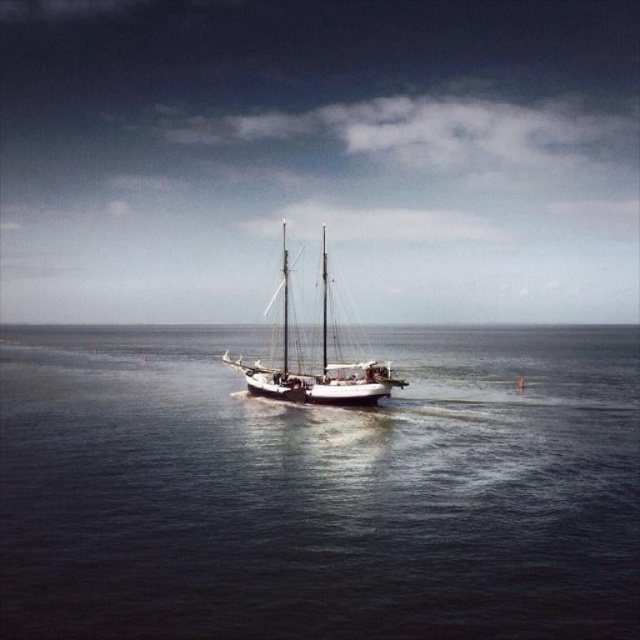
Question: Is the position of dark blue water at center less distant than that of white wooden sailboat at center?

Choices:
 (A) no
 (B) yes

Answer: (B)

Question: Which of the following is the closest to the observer?

Choices:
 (A) white wooden sailboat at center
 (B) dark blue water at center

Answer: (B)

Question: Is dark blue water at center positioned in front of white wooden sailboat at center?

Choices:
 (A) yes
 (B) no

Answer: (A)

Question: Does dark blue water at center have a greater width compared to white wooden sailboat at center?

Choices:
 (A) no
 (B) yes

Answer: (B)